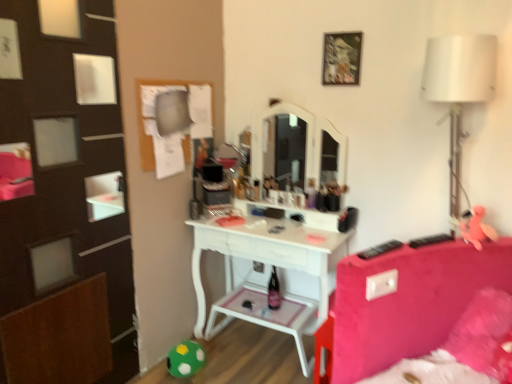
Question: Is pink rubber duck at right, which is the second toy in back-to-front order, taller or shorter than wooden picture frame at upper center?

Choices:
 (A) short
 (B) tall

Answer: (A)

Question: Considering their positions, is pink rubber duck at right, which is counted as the 2th toy, starting from the bottom, located in front of or behind wooden picture frame at upper center?

Choices:
 (A) behind
 (B) front

Answer: (B)

Question: Which of these objects is positioned farthest from the green felt ball at lower left, which appears as the 1th toy when viewed from the back?

Choices:
 (A) white fabric lampshade at right
 (B) wooden picture frame at upper center
 (C) pink rubber duck at right, acting as the 1th toy starting from the right

Answer: (A)

Question: Estimate the real-world distances between objects in this image. Which object is farther from the pink rubber duck at right, acting as the 1th toy starting from the right?

Choices:
 (A) wooden picture frame at upper center
 (B) white fabric lampshade at right
 (C) green felt ball at lower left, which appears as the 1th toy when viewed from the back

Answer: (C)